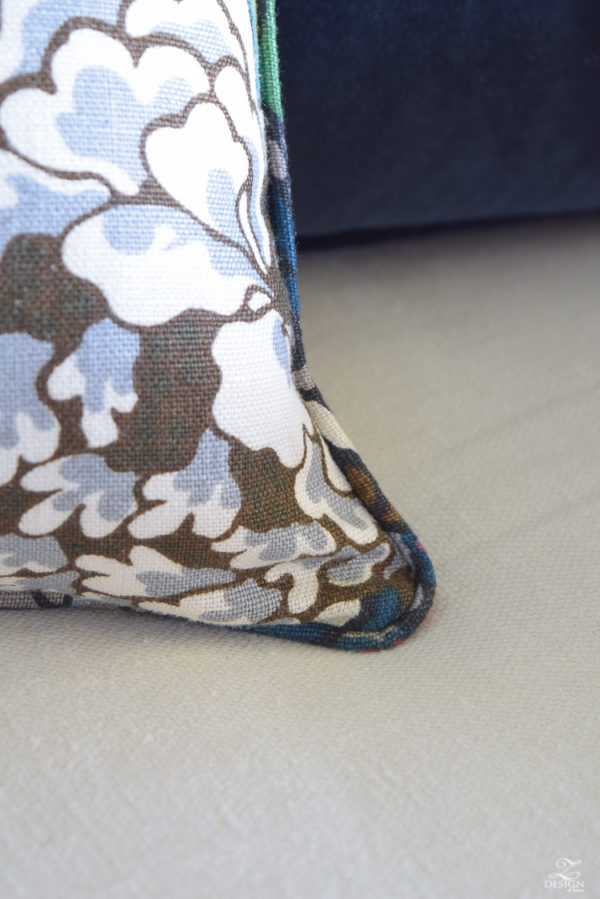
Where is `white fabric background`? white fabric background is located at coordinates (477, 399).